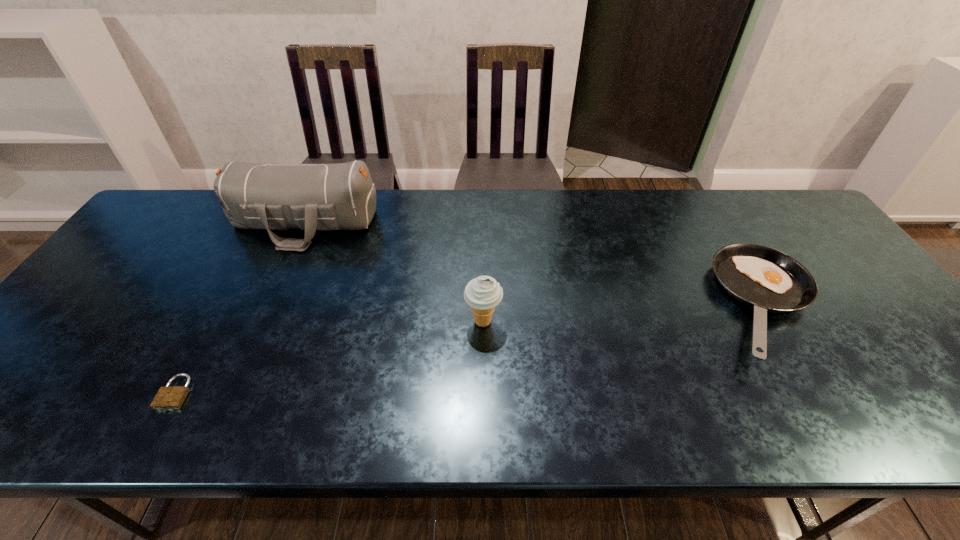
The width and height of the screenshot is (960, 540). In order to click on free space between the icecream and the duffel bag in this screenshot , I will do `click(394, 272)`.

At what (x,y) coordinates should I click in order to perform the action: click on free area in between the rightmost object and the duffel bag. Please return your answer as a coordinate pair (x, y). The image size is (960, 540). Looking at the image, I should click on (536, 264).

Where is `free point between the shortest object and the rightmost object`? free point between the shortest object and the rightmost object is located at coordinates (471, 349).

The height and width of the screenshot is (540, 960). I want to click on blank region between the icecream and the duffel bag, so click(x=394, y=272).

Where is `empty location between the second tallest object and the nearest object`? empty location between the second tallest object and the nearest object is located at coordinates (329, 357).

What are the coordinates of `empty space between the icecream and the duffel bag` in the screenshot? It's located at (394, 272).

Where is `free space between the duffel bag and the third tallest object`? The width and height of the screenshot is (960, 540). free space between the duffel bag and the third tallest object is located at coordinates (536, 264).

Where is `empty location between the second tallest object and the second shortest object`? empty location between the second tallest object and the second shortest object is located at coordinates (625, 314).

Where is `object that is the second closest to the icecream`? The height and width of the screenshot is (540, 960). object that is the second closest to the icecream is located at coordinates (767, 280).

Where is `object that stands as the second closest to the third shortest object`? object that stands as the second closest to the third shortest object is located at coordinates (767, 280).